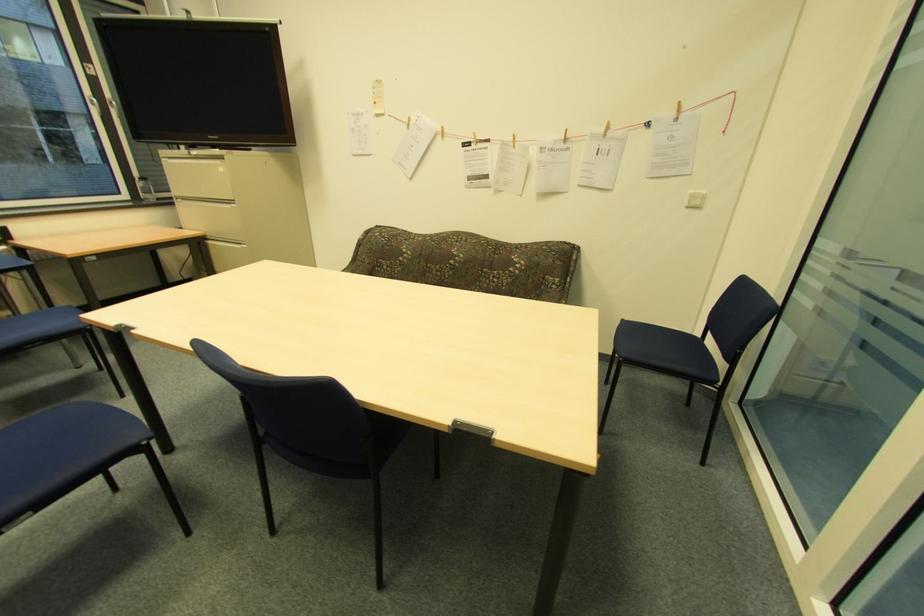
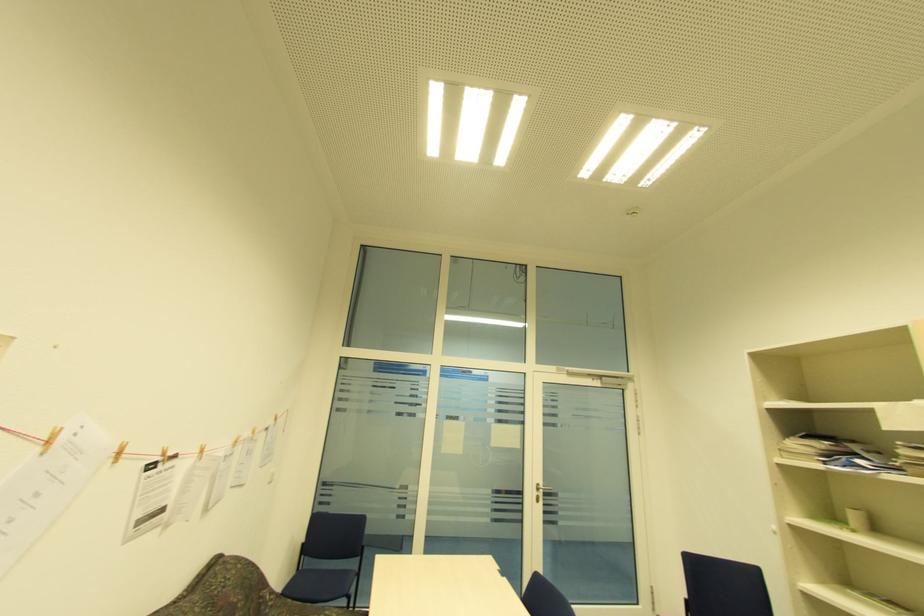
The point at (x=444, y=132) is marked in the first image. Where is the corresponding point in the second image?

(120, 454)